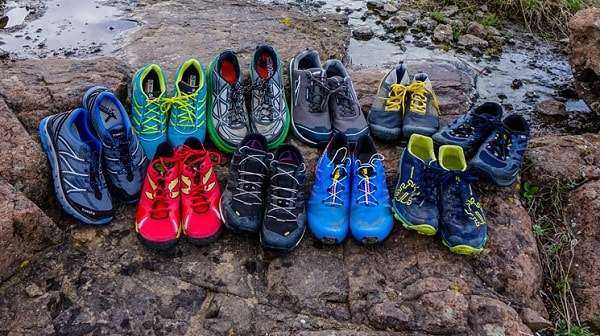
Where is `shoe pair`? shoe pair is located at coordinates (105, 138), (169, 108), (243, 102), (320, 109), (400, 108), (476, 136), (429, 189), (368, 189), (259, 195), (181, 191).